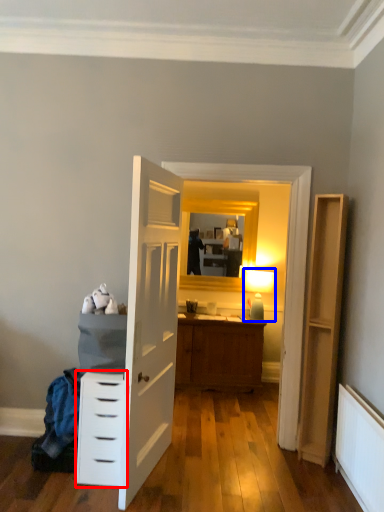
Question: Which object appears closest to the camera in this image, chest of drawers (highlighted by a red box) or light fixture (highlighted by a blue box)?

Choices:
 (A) chest of drawers
 (B) light fixture

Answer: (A)